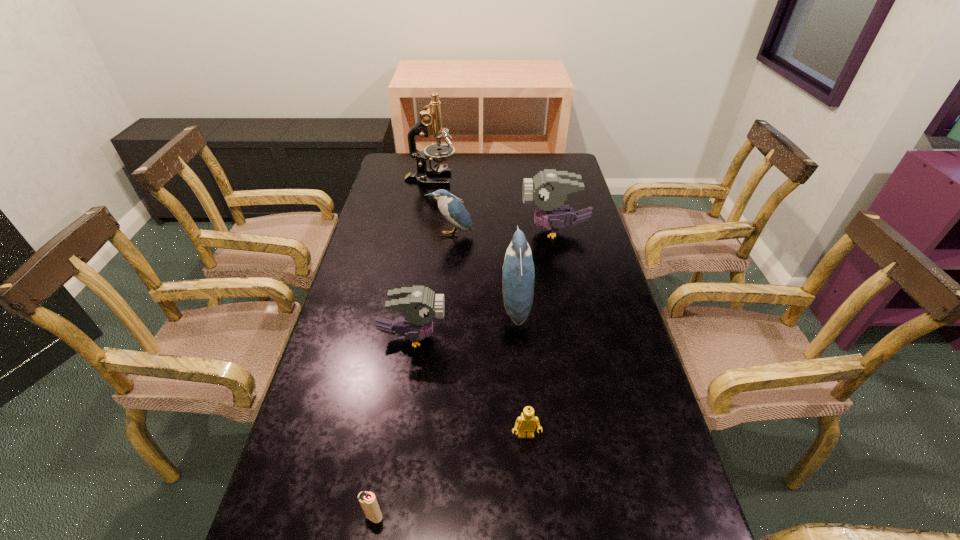
The width and height of the screenshot is (960, 540). Find the location of `vacant space at the left edge`. vacant space at the left edge is located at coordinates (336, 451).

The width and height of the screenshot is (960, 540). In the image, there is a desktop. In order to click on vacant space at the right edge in this screenshot , I will do `click(574, 208)`.

The width and height of the screenshot is (960, 540). I want to click on free space between the left gray bird and the red igniter, so click(394, 427).

The height and width of the screenshot is (540, 960). In order to click on free area in between the left blue bird and the nearer blue bird in this screenshot , I will do `click(483, 270)`.

This screenshot has width=960, height=540. I want to click on vacant point located between the right gray bird and the tallest object, so click(492, 205).

The height and width of the screenshot is (540, 960). Find the location of `vacant space in between the farthest object and the bigger blue bird`. vacant space in between the farthest object and the bigger blue bird is located at coordinates (473, 242).

Where is `vacant space that's between the left blue bird and the Lego`? This screenshot has height=540, width=960. vacant space that's between the left blue bird and the Lego is located at coordinates (489, 335).

At what (x,y) coordinates should I click in order to perform the action: click on empty space that is in between the microscope and the Lego. Please return your answer as a coordinate pair (x, y). The image size is (960, 540). Looking at the image, I should click on (478, 307).

Locate an element on the screen. free space between the microscope and the nearer gray bird is located at coordinates (421, 258).

The height and width of the screenshot is (540, 960). Find the location of `free point between the microscope and the bigger gray bird`. free point between the microscope and the bigger gray bird is located at coordinates (492, 205).